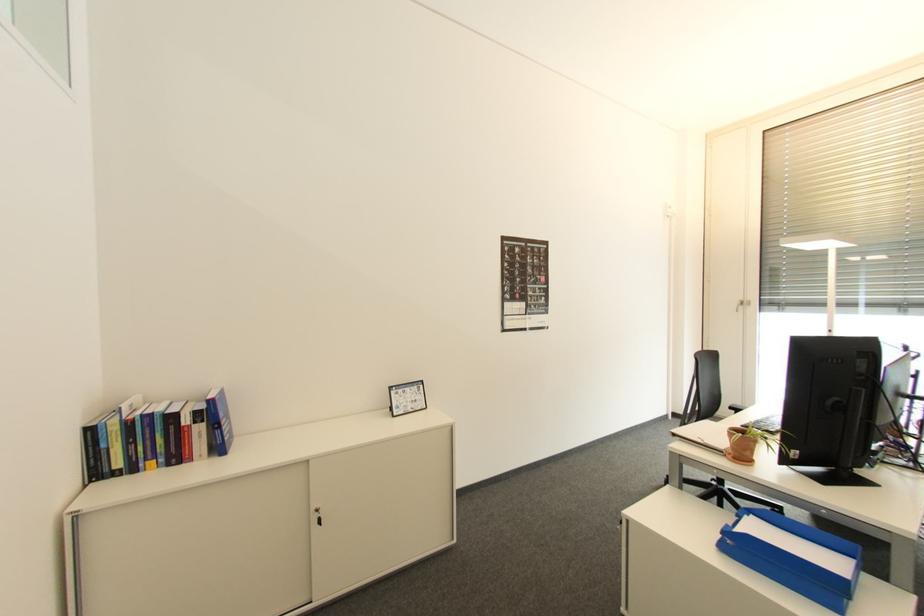
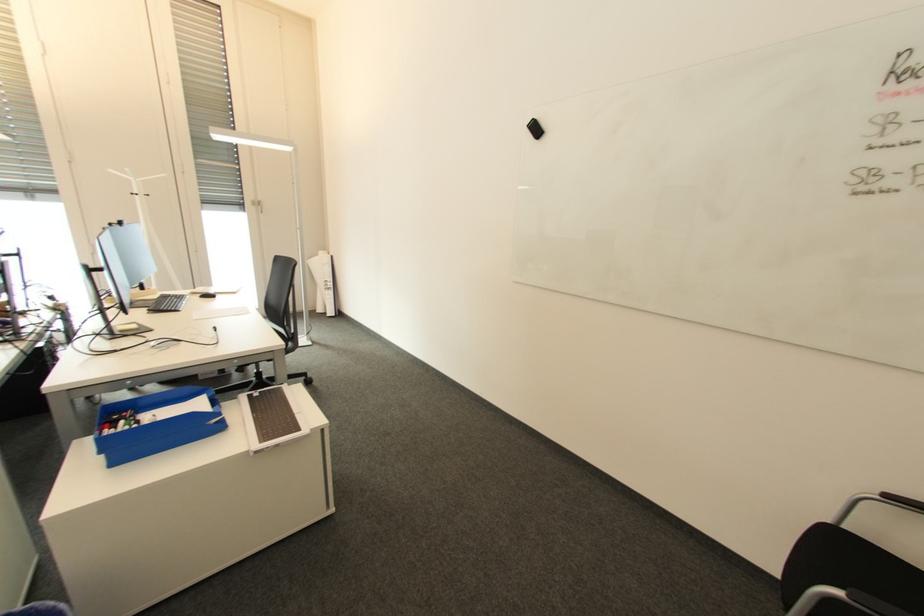
First-person continuous shooting, in which direction is the camera rotating?

The rotation direction of the camera is right-down.